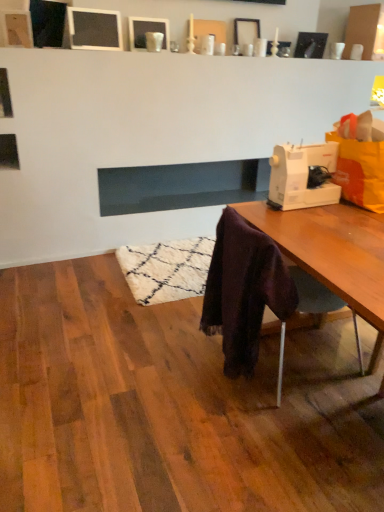
Question: From the image's perspective, would you say dark glass fireplace at center is positioned over matte white picture frame at upper center, which appears as the second picture frame when viewed from the right?

Choices:
 (A) yes
 (B) no

Answer: (B)

Question: From a real-world perspective, is dark glass fireplace at center below matte white picture frame at upper center, which appears as the second picture frame when viewed from the right?

Choices:
 (A) yes
 (B) no

Answer: (A)

Question: Considering the relative sizes of dark glass fireplace at center and matte white picture frame at upper center, which appears as the second picture frame when viewed from the right, in the image provided, is dark glass fireplace at center shorter than matte white picture frame at upper center, which appears as the second picture frame when viewed from the right,?

Choices:
 (A) no
 (B) yes

Answer: (A)

Question: Is dark glass fireplace at center with matte white picture frame at upper center, which appears as the second picture frame when viewed from the right?

Choices:
 (A) no
 (B) yes

Answer: (A)

Question: Is the position of dark glass fireplace at center more distant than that of matte white picture frame at upper center, which appears as the second picture frame when viewed from the right?

Choices:
 (A) yes
 (B) no

Answer: (B)

Question: Would you consider dark glass fireplace at center to be distant from matte white picture frame at upper center, which appears as the second picture frame when viewed from the right?

Choices:
 (A) yes
 (B) no

Answer: (A)

Question: Is dark glass fireplace at center facing towards matte black picture frame at upper center, which appears as the 4th picture frame when viewed from the right?

Choices:
 (A) yes
 (B) no

Answer: (B)

Question: From the image's perspective, is dark glass fireplace at center beneath matte black picture frame at upper center, acting as the 1th picture frame starting from the left?

Choices:
 (A) no
 (B) yes

Answer: (B)

Question: Does dark glass fireplace at center have a greater height compared to matte black picture frame at upper center, acting as the 1th picture frame starting from the left?

Choices:
 (A) yes
 (B) no

Answer: (A)

Question: From the image's perspective, is dark glass fireplace at center on matte black picture frame at upper center, acting as the 1th picture frame starting from the left?

Choices:
 (A) no
 (B) yes

Answer: (A)

Question: Can you confirm if dark glass fireplace at center is wider than matte black picture frame at upper center, acting as the 1th picture frame starting from the left?

Choices:
 (A) no
 (B) yes

Answer: (B)

Question: Can you confirm if dark glass fireplace at center is bigger than matte black picture frame at upper center, acting as the 1th picture frame starting from the left?

Choices:
 (A) no
 (B) yes

Answer: (B)

Question: Can you confirm if dark glass fireplace at center is bigger than white plastic sewing machine at right?

Choices:
 (A) no
 (B) yes

Answer: (B)